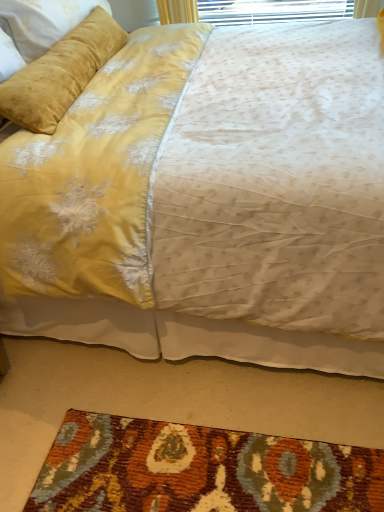
The image size is (384, 512). What do you see at coordinates (61, 73) in the screenshot?
I see `velvet yellow pillow at upper left` at bounding box center [61, 73].

The width and height of the screenshot is (384, 512). What are the coordinates of `velvet yellow pillow at upper left` in the screenshot? It's located at (61, 73).

Is velvet yellow bed at upper center aimed at textured wool mat at lower center?

No, velvet yellow bed at upper center is not facing towards textured wool mat at lower center.

Is velvet yellow bed at upper center shorter than textured wool mat at lower center?

In fact, velvet yellow bed at upper center may be taller than textured wool mat at lower center.

From the image's perspective, between velvet yellow bed at upper center and textured wool mat at lower center, which one is located above?

velvet yellow bed at upper center, from the image's perspective.

Would you consider velvet yellow pillow at upper left to be distant from textured wool mat at lower center?

velvet yellow pillow at upper left is positioned a significant distance from textured wool mat at lower center.

From the image's perspective, which is above, velvet yellow pillow at upper left or textured wool mat at lower center?

From the image's view, velvet yellow pillow at upper left is above.

Between velvet yellow pillow at upper left and textured wool mat at lower center, which one is positioned behind?

velvet yellow pillow at upper left.

From a real-world perspective, is velvet yellow pillow at upper left located beneath textured wool mat at lower center?

Incorrect, from a real-world perspective, velvet yellow pillow at upper left is higher than textured wool mat at lower center.

Is the depth of textured wool mat at lower center less than that of velvet yellow pillow at upper left?

Yes, textured wool mat at lower center is closer to the camera.

Between textured wool mat at lower center and velvet yellow pillow at upper left, which one appears on the left side from the viewer's perspective?

velvet yellow pillow at upper left.

Is there a large distance between textured wool mat at lower center and velvet yellow pillow at upper left?

Yes.

Which point is more distant from viewer, (x=54, y=447) or (x=38, y=104)?

The point (x=38, y=104) is farther from the camera.

Is velvet yellow bed at upper center positioned beyond the bounds of velvet yellow pillow at upper left?

Yes, velvet yellow bed at upper center is located beyond the bounds of velvet yellow pillow at upper left.

Which object is closer to the camera taking this photo, velvet yellow bed at upper center or velvet yellow pillow at upper left?

velvet yellow bed at upper center is more forward.

Which of these two, velvet yellow bed at upper center or velvet yellow pillow at upper left, is smaller?

With smaller size is velvet yellow pillow at upper left.

Based on the photo, is textured wool mat at lower center aimed at velvet yellow bed at upper center?

No, textured wool mat at lower center is not oriented towards velvet yellow bed at upper center.

From the image's perspective, between textured wool mat at lower center and velvet yellow bed at upper center, who is located below?

textured wool mat at lower center.

Does point (162, 499) come closer to viewer compared to point (346, 267)?

No, (162, 499) is further to viewer.

Who is bigger, textured wool mat at lower center or velvet yellow bed at upper center?

Bigger between the two is velvet yellow bed at upper center.

Is the position of velvet yellow pillow at upper left more distant than that of velvet yellow bed at upper center?

Yes, velvet yellow pillow at upper left is further from the viewer.

Does velvet yellow pillow at upper left have a larger size compared to velvet yellow bed at upper center?

No, velvet yellow pillow at upper left is not bigger than velvet yellow bed at upper center.

Is point (120, 27) positioned before point (234, 134)?

No.

Choose the correct answer: Is velvet yellow pillow at upper left inside velvet yellow bed at upper center or outside it?

velvet yellow pillow at upper left lies within the bounds of velvet yellow bed at upper center.

At what (x,y) coordinates should I click in order to perform the action: click on mat below the velvet yellow bed at upper center (from a real-world perspective). Please return your answer as a coordinate pair (x, y). The height and width of the screenshot is (512, 384). Looking at the image, I should click on (199, 470).

Image resolution: width=384 pixels, height=512 pixels. I want to click on mat below the velvet yellow pillow at upper left (from the image's perspective), so click(x=199, y=470).

Considering their positions, is velvet yellow pillow at upper left positioned further to velvet yellow bed at upper center than textured wool mat at lower center?

textured wool mat at lower center is further to velvet yellow bed at upper center.

From the image, which object appears to be farther from textured wool mat at lower center, velvet yellow pillow at upper left or velvet yellow bed at upper center?

The object further to textured wool mat at lower center is velvet yellow pillow at upper left.

Considering their positions, is textured wool mat at lower center positioned closer to velvet yellow bed at upper center than velvet yellow pillow at upper left?

Among the two, velvet yellow pillow at upper left is located nearer to velvet yellow bed at upper center.

Estimate the real-world distances between objects in this image. Which object is closer to textured wool mat at lower center, velvet yellow bed at upper center or velvet yellow pillow at upper left?

velvet yellow bed at upper center is closer to textured wool mat at lower center.

When comparing their distances from velvet yellow pillow at upper left, does velvet yellow bed at upper center or textured wool mat at lower center seem further?

textured wool mat at lower center is further to velvet yellow pillow at upper left.

When comparing their distances from velvet yellow pillow at upper left, does textured wool mat at lower center or velvet yellow bed at upper center seem further?

The object further to velvet yellow pillow at upper left is textured wool mat at lower center.

Find the location of a particular element. The width and height of the screenshot is (384, 512). bed between velvet yellow pillow at upper left and textured wool mat at lower center vertically is located at coordinates (211, 201).